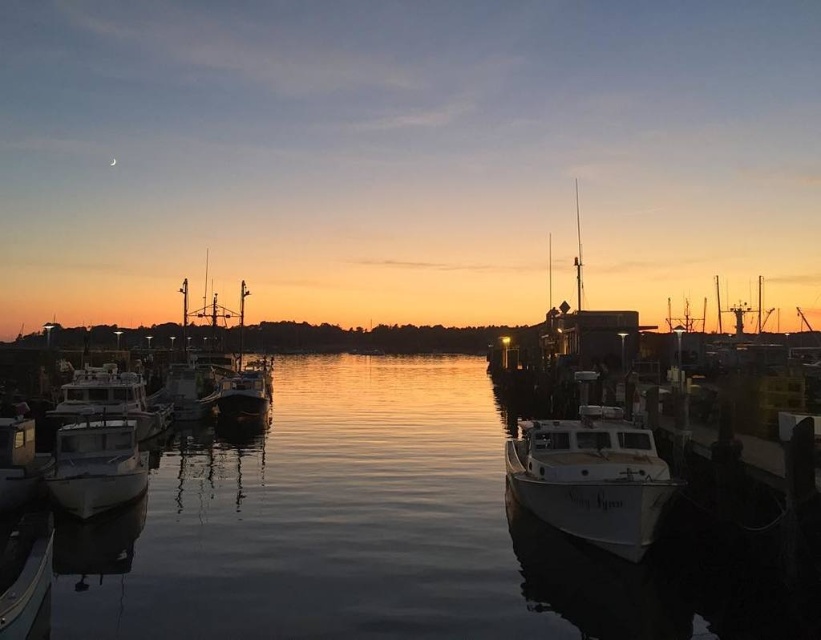
Question: Among these points, which one is nearest to the camera?

Choices:
 (A) (562, 429)
 (B) (83, 435)
 (C) (159, 432)
 (D) (214, 355)

Answer: (A)

Question: Based on their relative distances, which object is nearer to the white matte boat at center?

Choices:
 (A) metallic silver boat at center
 (B) white matte boat at left
 (C) metallic white boat at left

Answer: (C)

Question: Among these points, which one is nearest to the camera?

Choices:
 (A) (268, 376)
 (B) (264, 557)
 (C) (164, 406)

Answer: (B)

Question: Where is glossy water at center located in relation to metallic white boat at left in the image?

Choices:
 (A) above
 (B) below

Answer: (B)

Question: In this image, where is white matte boat at center located relative to white matte boat at left?

Choices:
 (A) left
 (B) right

Answer: (B)

Question: Can you confirm if metallic silver boat at center is smaller than white glossy boat at lower left?

Choices:
 (A) no
 (B) yes

Answer: (A)